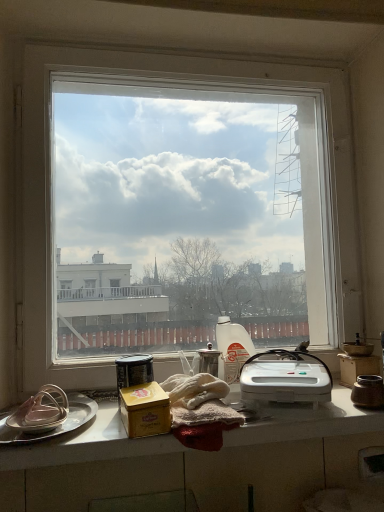
Locate an element on the screen. The height and width of the screenshot is (512, 384). free space to the left of brown ceramic jar at right, the 1th appliance from the right is located at coordinates (326, 413).